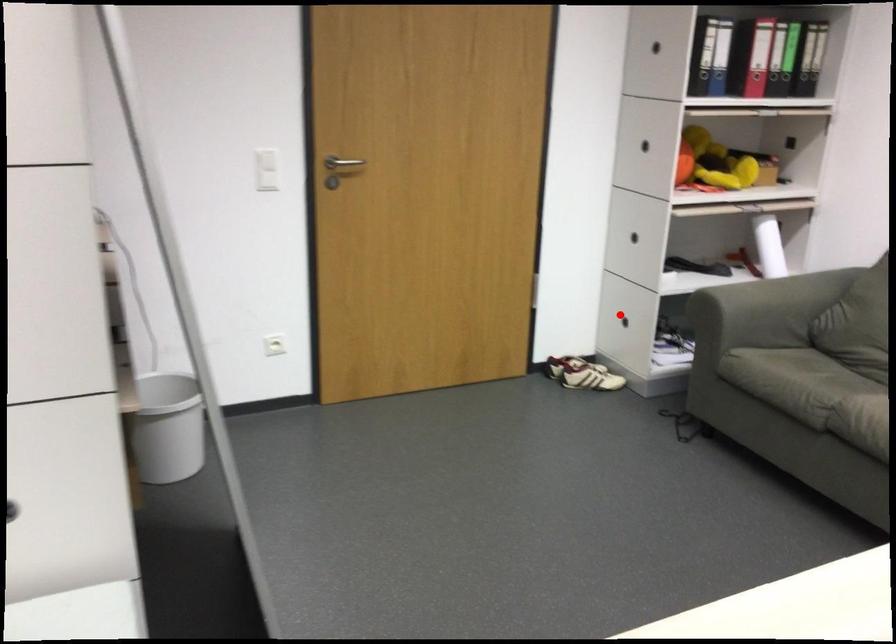
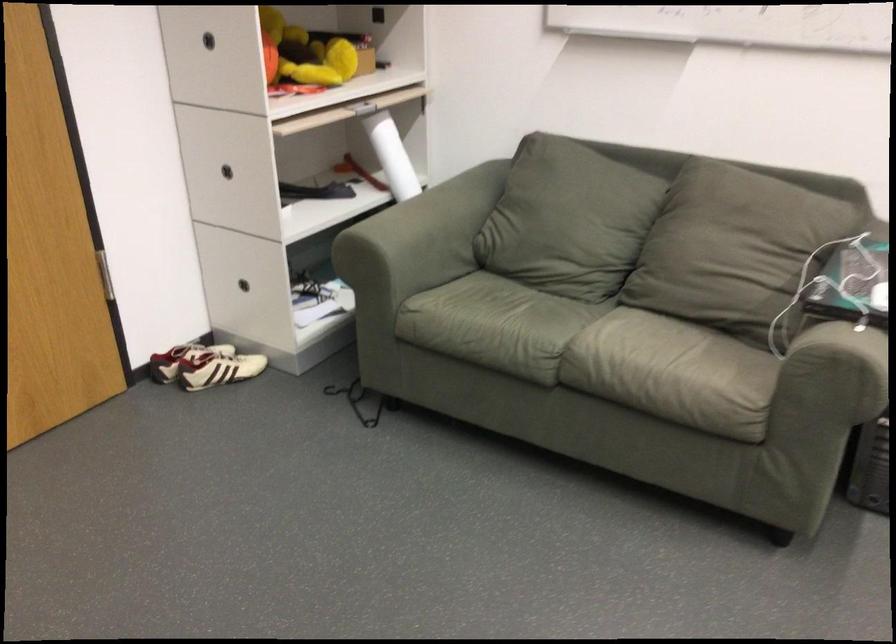
Question: A red point is marked in image1. In image2, is the corresponding 3D point closer to the camera or farther? Reply with the corresponding letter.

Choices:
 (A) The corresponding 3D point is closer.
 (B) The corresponding 3D point is farther.

Answer: (A)